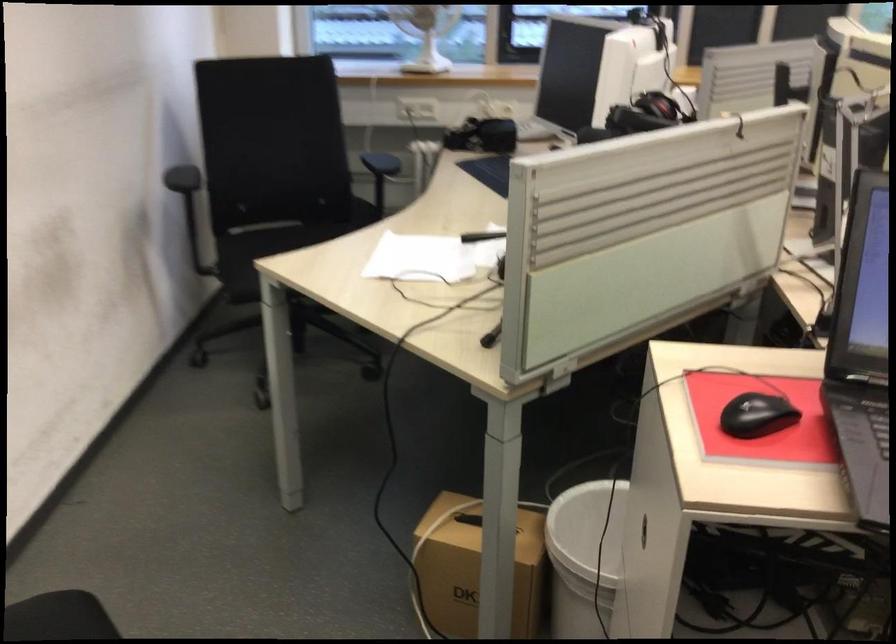
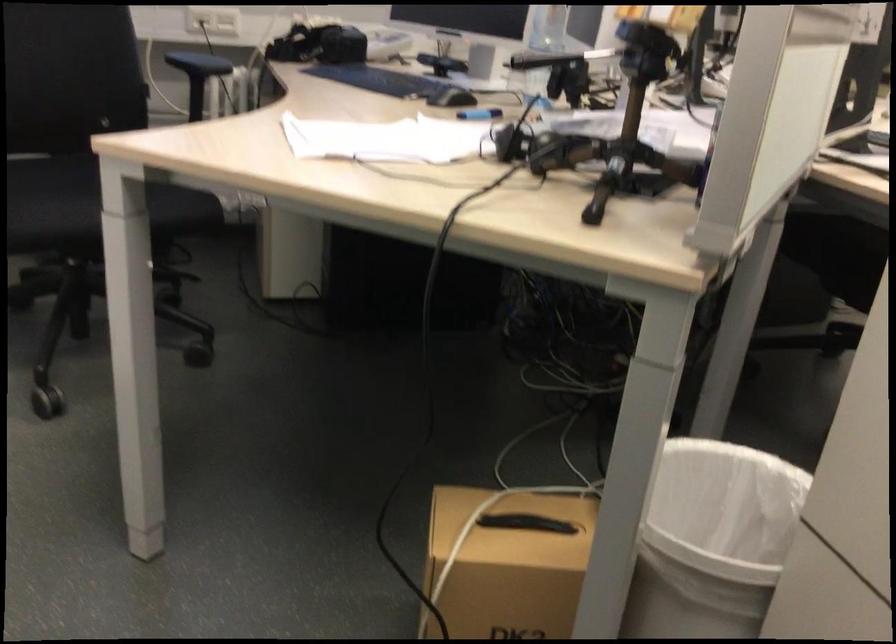
Question: The camera is either moving clockwise (left) or counter-clockwise (right) around the object. The first image is from the beginning of the video and the second image is from the end. Is the camera moving left or right when shooting the video?

Choices:
 (A) Left
 (B) Right

Answer: (A)